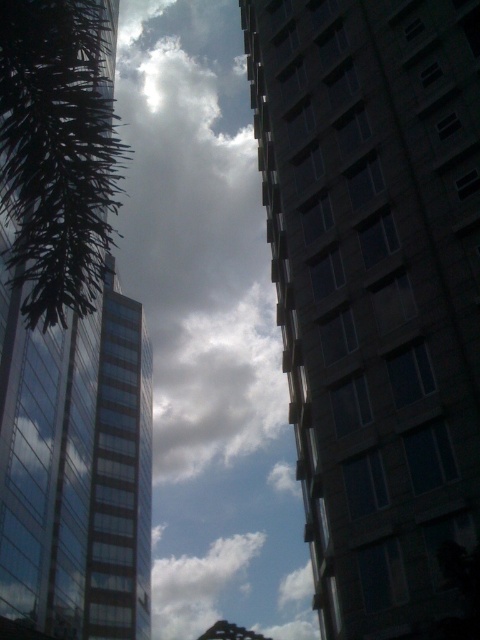
Is dark glass building at right smaller than green leafy palm tree at left?

Correct, dark glass building at right occupies less space than green leafy palm tree at left.

Which is behind, point (431, 96) or point (94, 168)?

Positioned behind is point (431, 96).

Locate an element on the screen. The width and height of the screenshot is (480, 640). dark glass building at right is located at coordinates (374, 289).

Find the location of a particular element. Image resolution: width=480 pixels, height=640 pixels. dark glass building at right is located at coordinates (374, 289).

What do you see at coordinates (58, 150) in the screenshot?
I see `green leafy palm tree at left` at bounding box center [58, 150].

Measure the distance between green leafy palm tree at left and white fluffy cloud at center.

They are 149.73 meters apart.

This screenshot has height=640, width=480. What do you see at coordinates (58, 150) in the screenshot?
I see `green leafy palm tree at left` at bounding box center [58, 150].

You are a GUI agent. You are given a task and a screenshot of the screen. Output one action in this format:
    pyautogui.click(x=<x>, y=<y>)
    Task: Click on the green leafy palm tree at left
    
    Given the screenshot: What is the action you would take?
    pyautogui.click(x=58, y=150)

In the scene shown: Is dark glass building at right positioned before white fluffy cloud at center?

Yes.

In the scene shown: Who is taller, dark glass building at right or white fluffy cloud at center?

white fluffy cloud at center is taller.

Where is `dark glass building at right`? This screenshot has height=640, width=480. dark glass building at right is located at coordinates (374, 289).

At what (x,y) coordinates should I click in order to perform the action: click on dark glass building at right. Please return your answer as a coordinate pair (x, y). This screenshot has height=640, width=480. Looking at the image, I should click on (374, 289).